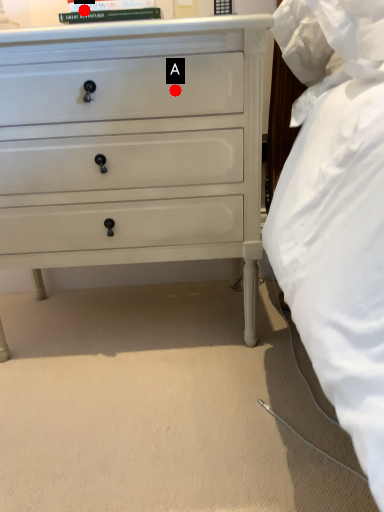
Question: Two points are circled on the image, labeled by A and B beside each circle. Which point is closer to the camera?

Choices:
 (A) A is closer
 (B) B is closer

Answer: (B)